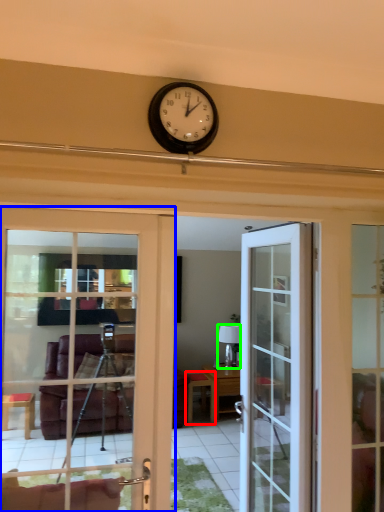
Question: Considering the real-world distances, which object is farthest from table (highlighted by a red box)? door (highlighted by a blue box) or lamp (highlighted by a green box)?

Choices:
 (A) door
 (B) lamp

Answer: (A)